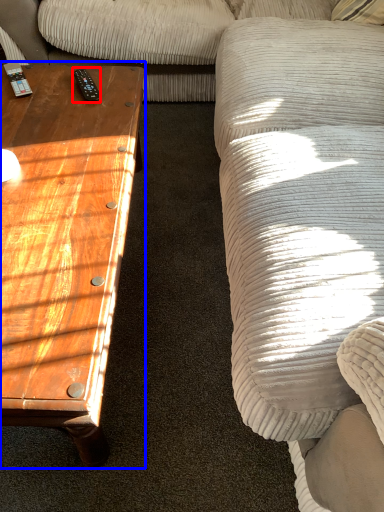
Question: Which object appears closest to the camera in this image, remote (highlighted by a red box) or coffee table (highlighted by a blue box)?

Choices:
 (A) remote
 (B) coffee table

Answer: (B)